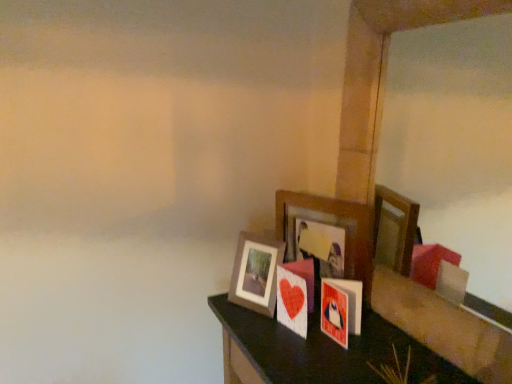
Question: Which is correct: wooden picture frame at center, the first picture frame viewed from the right, is inside wooden photo frame at center, the 2th picture frame positioned from the right, or outside of it?

Choices:
 (A) inside
 (B) outside

Answer: (B)

Question: In the image, is wooden picture frame at center, acting as the 2th picture frame starting from the left, on the left side or the right side of wooden photo frame at center, the first picture frame in the left-to-right sequence?

Choices:
 (A) left
 (B) right

Answer: (B)

Question: From a real-world perspective, relative to wooden photo frame at center, the first picture frame in the left-to-right sequence, is wooden picture frame at center, acting as the 2th picture frame starting from the left, vertically above or below?

Choices:
 (A) below
 (B) above

Answer: (B)

Question: From the image's perspective, is wooden photo frame at center, the first picture frame in the left-to-right sequence, positioned above or below wooden picture frame at center, acting as the 2th picture frame starting from the left?

Choices:
 (A) above
 (B) below

Answer: (B)

Question: Looking at their shapes, would you say wooden photo frame at center, the 2th picture frame positioned from the right, is wider or thinner than wooden picture frame at center, the first picture frame viewed from the right?

Choices:
 (A) thin
 (B) wide

Answer: (B)

Question: In terms of height, does wooden photo frame at center, the 2th picture frame positioned from the right, look taller or shorter compared to wooden picture frame at center, acting as the 2th picture frame starting from the left?

Choices:
 (A) short
 (B) tall

Answer: (A)

Question: From a real-world perspective, is wooden photo frame at center, the 2th picture frame positioned from the right, physically located above or below wooden picture frame at center, acting as the 2th picture frame starting from the left?

Choices:
 (A) below
 (B) above

Answer: (A)